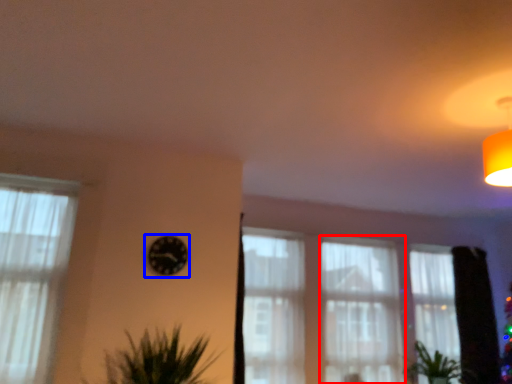
Question: Which object appears farthest to the camera in this image, curtain (highlighted by a red box) or clock (highlighted by a blue box)?

Choices:
 (A) curtain
 (B) clock

Answer: (A)